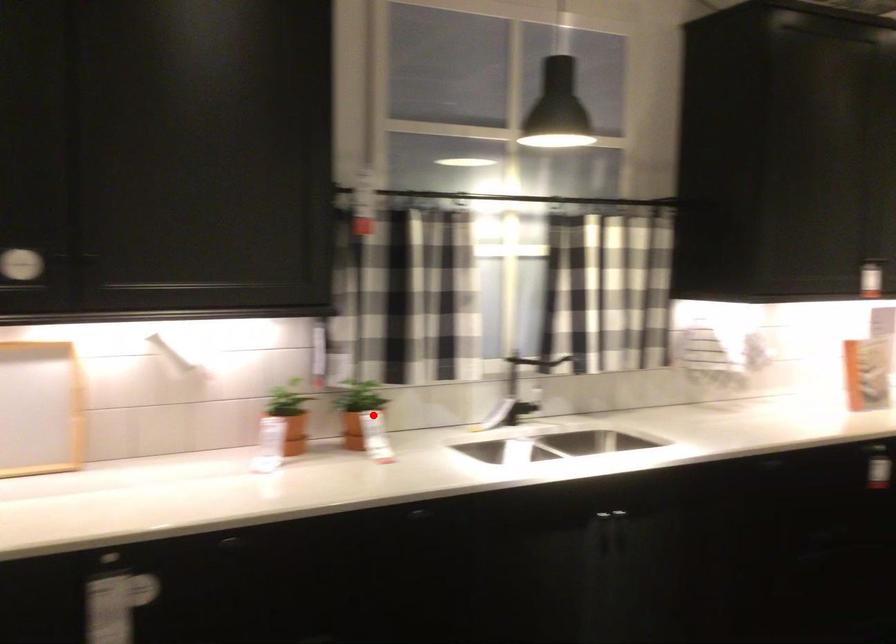
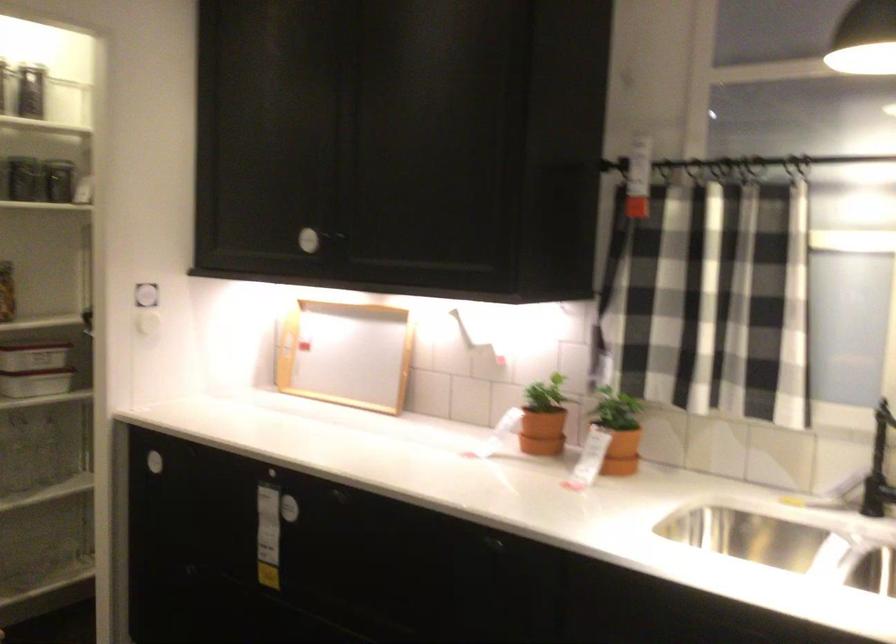
Question: A red point is marked in image1. In image2, is the corresponding 3D point closer to the camera or farther? Reply with the corresponding letter.

Choices:
 (A) The corresponding 3D point is closer.
 (B) The corresponding 3D point is farther.

Answer: (A)